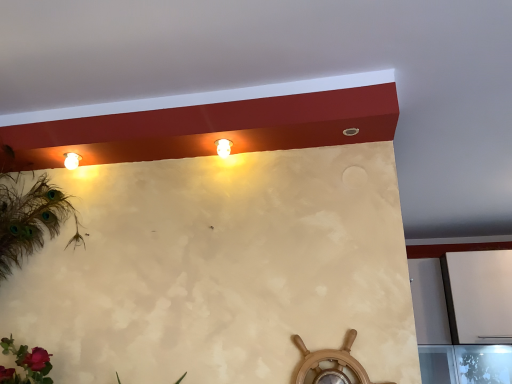
Question: From a real-world perspective, is white glossy light fixture at upper center physically located above or below matte white lamp at upper left?

Choices:
 (A) above
 (B) below

Answer: (B)

Question: Do you think white glossy light fixture at upper center is within matte white lamp at upper left, or outside of it?

Choices:
 (A) outside
 (B) inside

Answer: (A)

Question: Based on their positions, is white glossy light fixture at upper center located to the left or right of matte white lamp at upper left?

Choices:
 (A) right
 (B) left

Answer: (A)

Question: Would you say matte white lamp at upper left is to the left or to the right of white glossy light fixture at upper center in the picture?

Choices:
 (A) right
 (B) left

Answer: (B)

Question: Is matte white lamp at upper left inside or outside of white glossy light fixture at upper center?

Choices:
 (A) outside
 (B) inside

Answer: (A)

Question: Considering the positions of point (73, 160) and point (225, 153), is point (73, 160) closer or farther from the camera than point (225, 153)?

Choices:
 (A) farther
 (B) closer

Answer: (A)

Question: Is matte white lamp at upper left bigger or smaller than white glossy light fixture at upper center?

Choices:
 (A) big
 (B) small

Answer: (B)